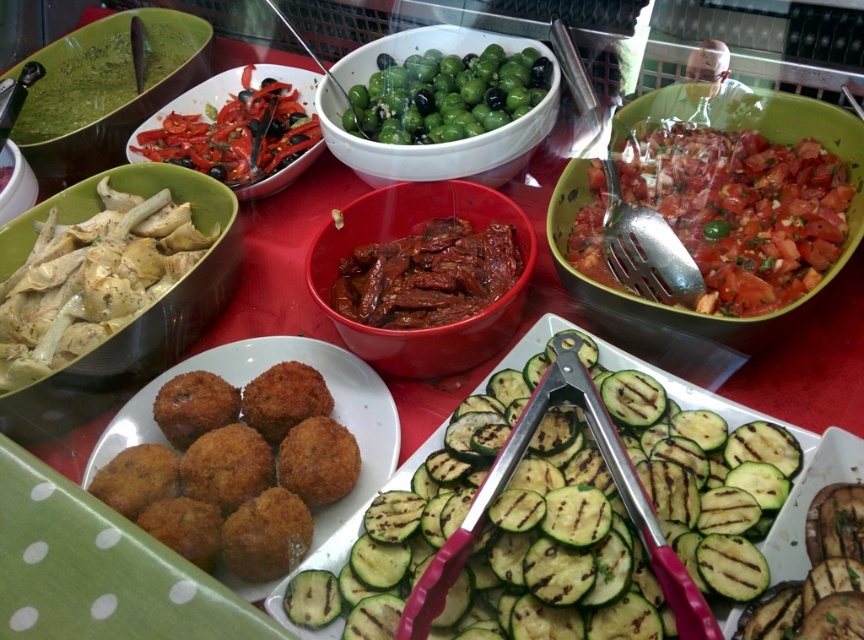
Which is in front, point (504, 285) or point (89, 116)?

Positioned in front is point (504, 285).

Between shiny red sun-dried tomatoes at center and green matte bowl at upper left, which one has more height?

green matte bowl at upper left is taller.

Between point (375, 301) and point (151, 68), which one is positioned behind?

Point (151, 68)

Locate an element on the screen. The width and height of the screenshot is (864, 640). shiny red sun-dried tomatoes at center is located at coordinates (427, 275).

Between point (831, 234) and point (513, 45), which one is positioned behind?

The point (513, 45) is behind.

Between chopped tomato salad at center right and green matte olives at center, which one is positioned higher?

green matte olives at center is above.

Locate an element on the screen. chopped tomato salad at center right is located at coordinates (742, 209).

Is green matte olives at center bigger than shiny red sun-dried tomatoes at center?

Correct, green matte olives at center is larger in size than shiny red sun-dried tomatoes at center.

Is green matte olives at center thinner than shiny red sun-dried tomatoes at center?

No.

The image size is (864, 640). Describe the element at coordinates (436, 144) in the screenshot. I see `green matte olives at center` at that location.

Locate an element on the screen. Image resolution: width=864 pixels, height=640 pixels. green matte olives at center is located at coordinates [x=436, y=144].